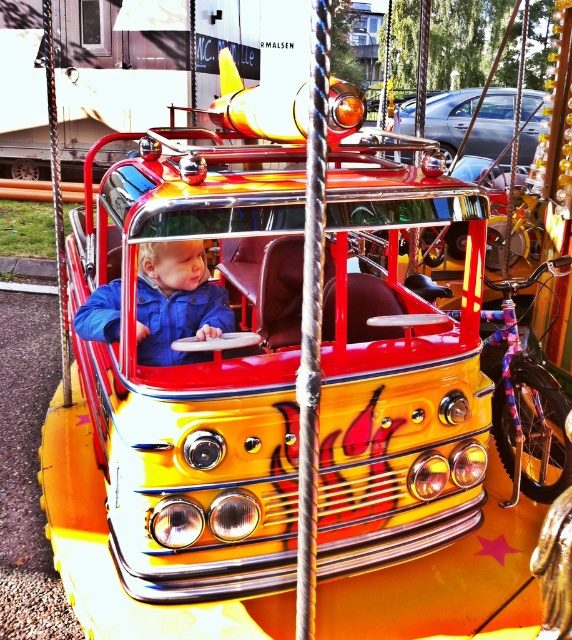
Question: Which point is farther from the camera taking this photo?

Choices:
 (A) (170, 276)
 (B) (456, 128)

Answer: (B)

Question: Among these points, which one is nearest to the camera?

Choices:
 (A) (502, 131)
 (B) (165, 308)

Answer: (B)

Question: Is blue fleece jacket at center wider than metallic silver car at upper center?

Choices:
 (A) yes
 (B) no

Answer: (B)

Question: Is blue fleece jacket at center closer to camera compared to metallic silver car at upper center?

Choices:
 (A) no
 (B) yes

Answer: (B)

Question: Does blue fleece jacket at center have a larger size compared to metallic silver car at upper center?

Choices:
 (A) no
 (B) yes

Answer: (A)